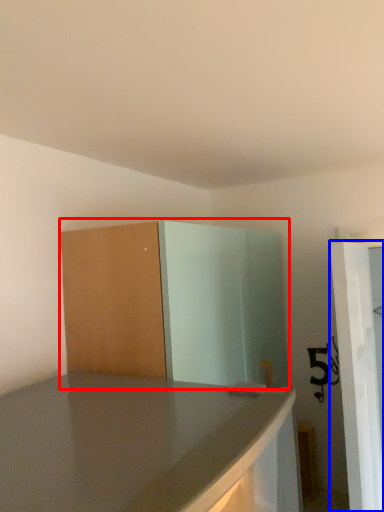
Question: Which object appears closest to the camera in this image, dresser (highlighted by a red box) or screen door (highlighted by a blue box)?

Choices:
 (A) dresser
 (B) screen door

Answer: (A)